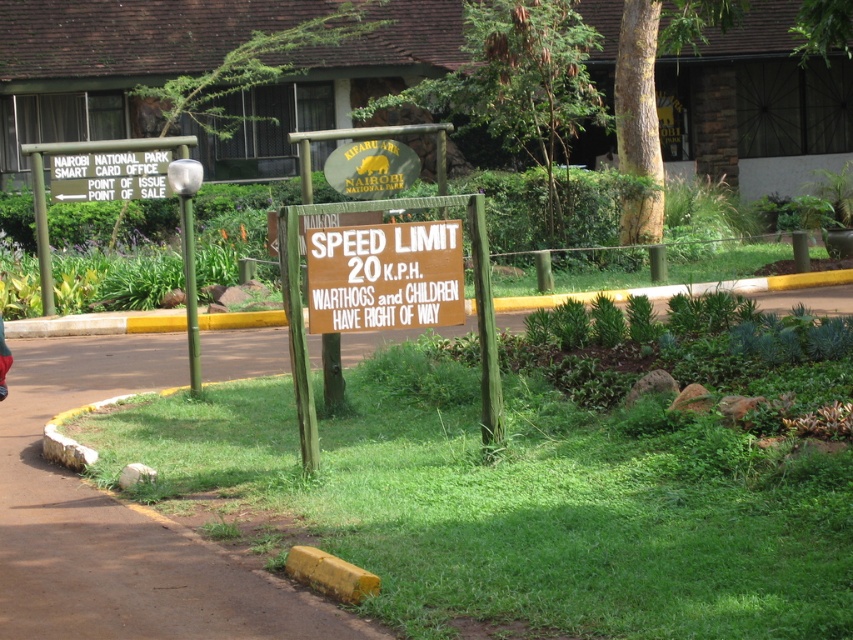
At what (x,y) coordinates should I click in order to perform the action: click on brown wooden sign at center. Please return your answer as a coordinate pair (x, y). Image resolution: width=853 pixels, height=640 pixels. Looking at the image, I should click on (384, 276).

Is point (386, 234) more distant than point (82, 163)?

No, (386, 234) is closer to viewer.

Who is more forward, (381, 273) or (97, 160)?

Positioned in front is point (381, 273).

Find the location of a particular element. Image resolution: width=853 pixels, height=640 pixels. brown wooden sign at center is located at coordinates (384, 276).